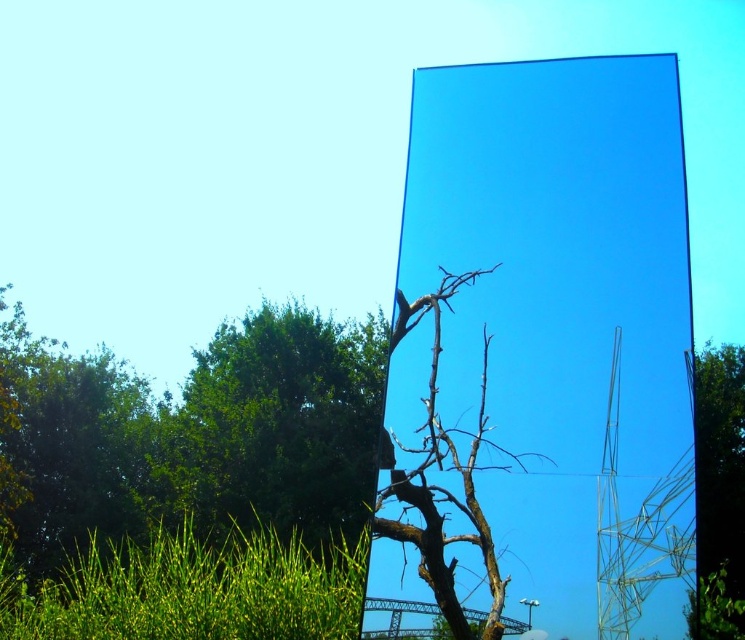
Who is more distant from viewer, [250,355] or [440,273]?

The point [250,355] is behind.

Between green leafy tree at lower left and brown matte tree at center, which one has less height?

brown matte tree at center is shorter.

The image size is (745, 640). What are the coordinates of `green leafy tree at lower left` in the screenshot? It's located at (273, 426).

Who is shorter, green leafy tree at lower left or green grass at lower left?

With less height is green leafy tree at lower left.

Is green leafy tree at lower left closer to camera compared to green grass at lower left?

No, it is behind green grass at lower left.

Find the location of a particular element. This screenshot has height=640, width=745. green leafy tree at lower left is located at coordinates (273, 426).

Which is above, green grass at lower left or green leafy tree at right?

green leafy tree at right is above.

Looking at this image, is green grass at lower left closer to the viewer compared to green leafy tree at right?

That is False.

At what (x,y) coordinates should I click in order to perform the action: click on green grass at lower left. Please return your answer as a coordinate pair (x, y). The height and width of the screenshot is (640, 745). Looking at the image, I should click on (191, 589).